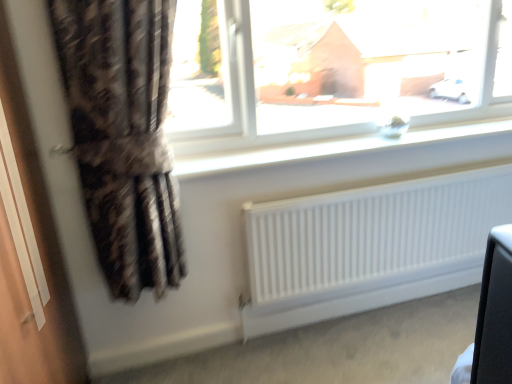
Question: Is the depth of white smooth window sill at upper center greater than that of transparent glass window at upper center?

Choices:
 (A) yes
 (B) no

Answer: (A)

Question: Considering the relative positions of white smooth window sill at upper center and transparent glass window at upper center in the image provided, is white smooth window sill at upper center to the left of transparent glass window at upper center from the viewer's perspective?

Choices:
 (A) yes
 (B) no

Answer: (B)

Question: Can you confirm if white smooth window sill at upper center is thinner than transparent glass window at upper center?

Choices:
 (A) yes
 (B) no

Answer: (B)

Question: Does white smooth window sill at upper center have a larger size compared to transparent glass window at upper center?

Choices:
 (A) no
 (B) yes

Answer: (A)

Question: Can you confirm if white smooth window sill at upper center is taller than transparent glass window at upper center?

Choices:
 (A) no
 (B) yes

Answer: (A)

Question: Is the depth of white smooth window sill at upper center less than that of transparent glass window at upper center?

Choices:
 (A) no
 (B) yes

Answer: (A)

Question: Is plaid fabric curtain at left bigger than white matte radiator at lower center?

Choices:
 (A) yes
 (B) no

Answer: (A)

Question: From the image's perspective, is plaid fabric curtain at left located beneath white matte radiator at lower center?

Choices:
 (A) no
 (B) yes

Answer: (A)

Question: From a real-world perspective, is plaid fabric curtain at left physically below white matte radiator at lower center?

Choices:
 (A) yes
 (B) no

Answer: (B)

Question: Are plaid fabric curtain at left and white matte radiator at lower center making contact?

Choices:
 (A) no
 (B) yes

Answer: (A)

Question: Is plaid fabric curtain at left smaller than white matte radiator at lower center?

Choices:
 (A) yes
 (B) no

Answer: (B)

Question: Does plaid fabric curtain at left have a lesser height compared to white matte radiator at lower center?

Choices:
 (A) no
 (B) yes

Answer: (A)

Question: From the image's perspective, would you say white smooth window sill at upper center is shown under white matte radiator at lower center?

Choices:
 (A) no
 (B) yes

Answer: (A)